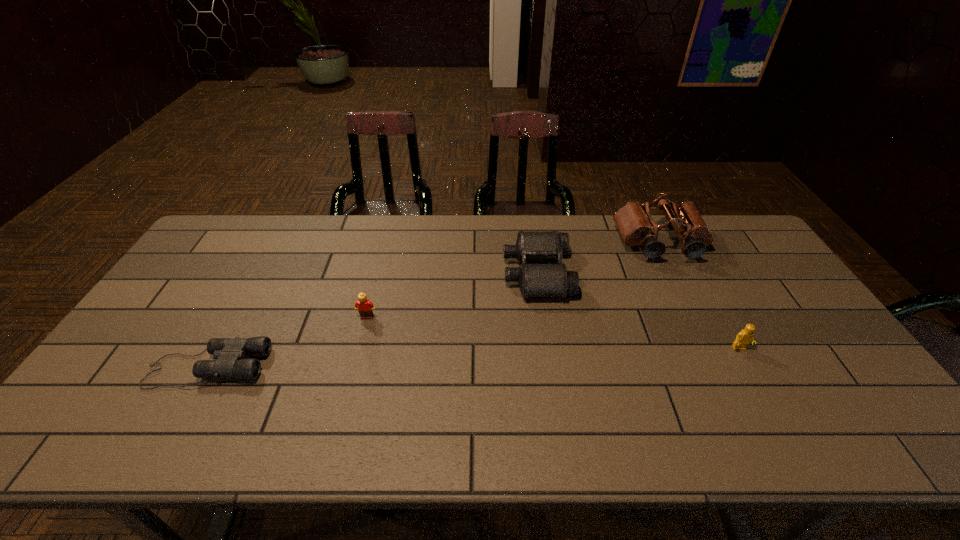
You are a GUI agent. You are given a task and a screenshot of the screen. Output one action in this format:
    pyautogui.click(x=<x>, y=<y>)
    Task: Click on the free space located through the eyepieces of the second tallest binoculars
    
    Given the screenshot: What is the action you would take?
    pyautogui.click(x=475, y=273)

Find the location of a particular element. Image resolution: width=960 pixels, height=540 pixels. vacant area situated through the eyepieces of the second tallest binoculars is located at coordinates (488, 273).

Where is `free location located through the eyepieces of the second tallest binoculars`? free location located through the eyepieces of the second tallest binoculars is located at coordinates (447, 273).

At what (x,y) coordinates should I click in order to perform the action: click on vacant space located 0.270m on the face of the second object from left to right. Please return your answer as a coordinate pair (x, y). The width and height of the screenshot is (960, 540). Looking at the image, I should click on (345, 404).

You are a GUI agent. You are given a task and a screenshot of the screen. Output one action in this format:
    pyautogui.click(x=<x>, y=<y>)
    Task: Click on the vacant space situated 0.250m on the face of the nearer Lego
    The width and height of the screenshot is (960, 540).
    Given the screenshot: What is the action you would take?
    pyautogui.click(x=791, y=443)

Where is `free space located at the eyepiece of the shortest binoculars`? free space located at the eyepiece of the shortest binoculars is located at coordinates (386, 367).

The image size is (960, 540). Identify the location of object positioned at the left edge. (229, 353).

The width and height of the screenshot is (960, 540). In the image, there is a desktop. Find the location of `free space at the far edge`. free space at the far edge is located at coordinates click(x=470, y=219).

The image size is (960, 540). In the image, there is a desktop. In order to click on free region at the near edge in this screenshot , I will do `click(374, 422)`.

In order to click on vacant space at the left edge in this screenshot , I will do `click(120, 373)`.